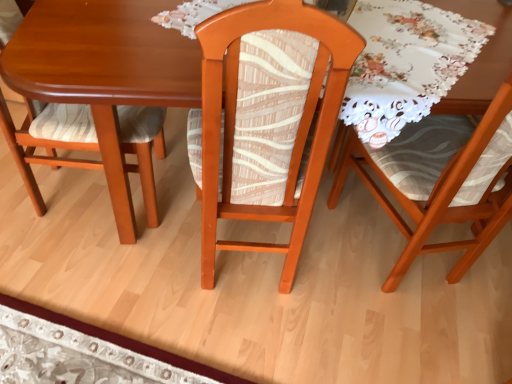
This screenshot has width=512, height=384. Identify the location of vacant area situated to the left side of wooden chair at right, which ranks as the 3th chair in left-to-right order. (317, 264).